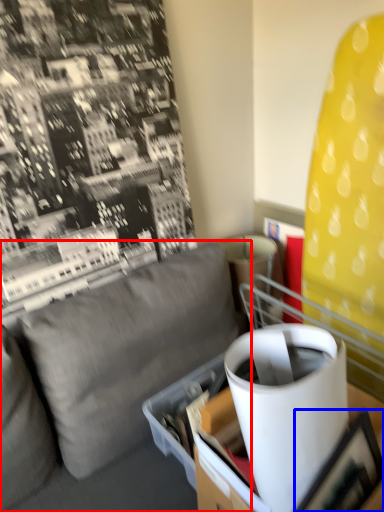
Question: Which object appears closest to the camera in this image, studio couch (highlighted by a red box) or picture frame (highlighted by a blue box)?

Choices:
 (A) studio couch
 (B) picture frame

Answer: (A)